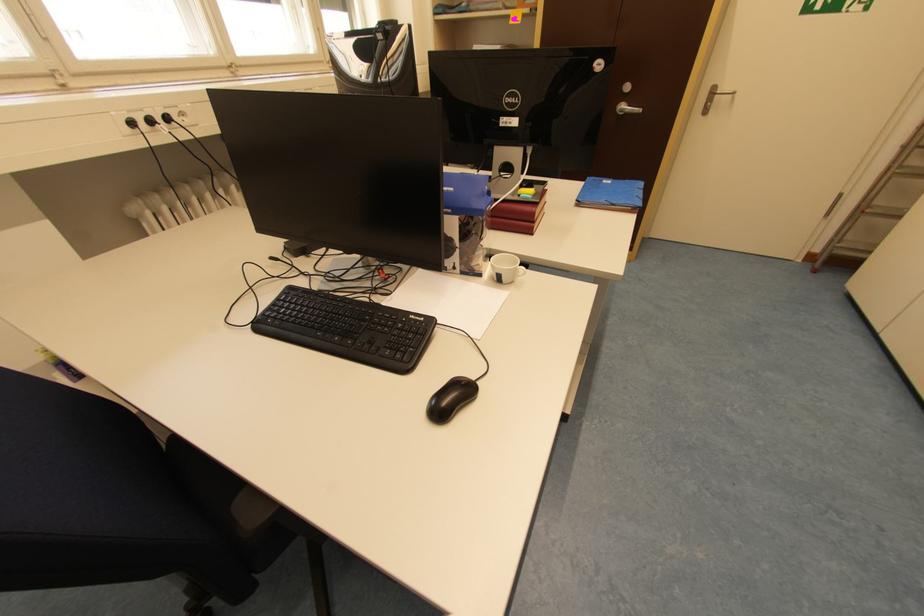
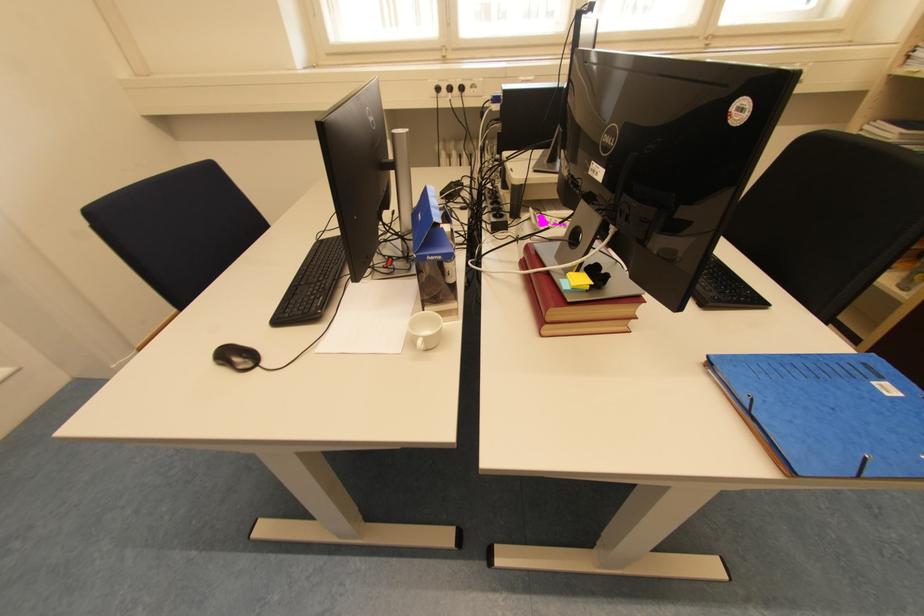
The first image is from the beginning of the video and the second image is from the end. How did the camera likely rotate when shooting the video?

The camera rotated toward left-down.